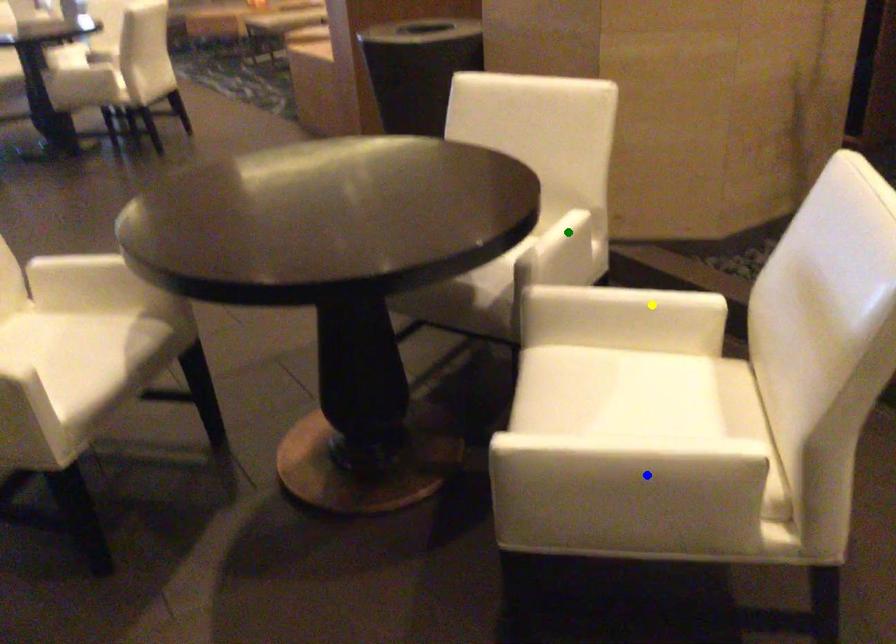
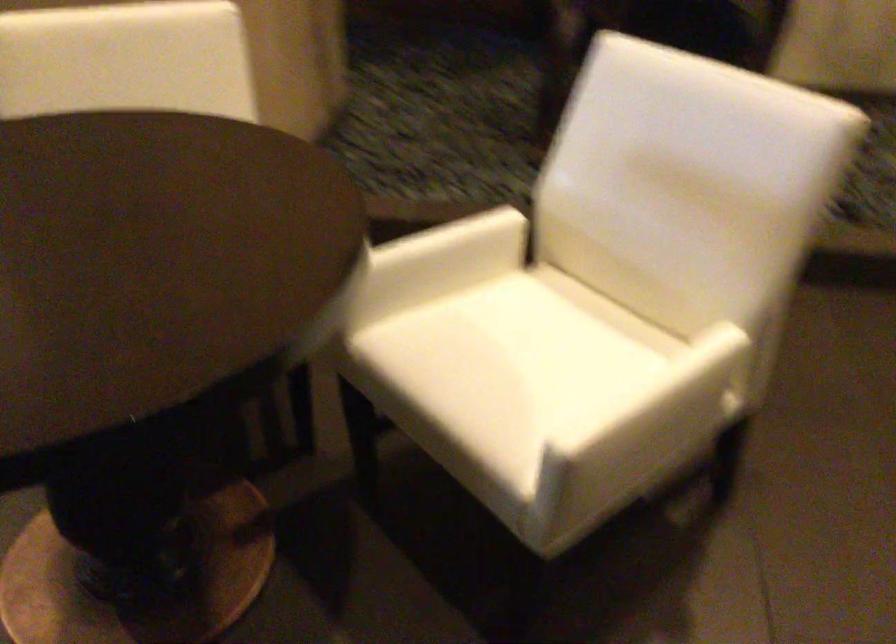
I am providing you with two images of the same scene from different viewpoints. Three points are marked in image1. Which point corresponds to a part or object that is occluded in image2?In image1, three points are marked. Which of them correspond to a part or object that is occluded in image2?Among the three points shown in image1, which one corresponds to a part or object that is no longer visible due to occlusion in image2?

green point